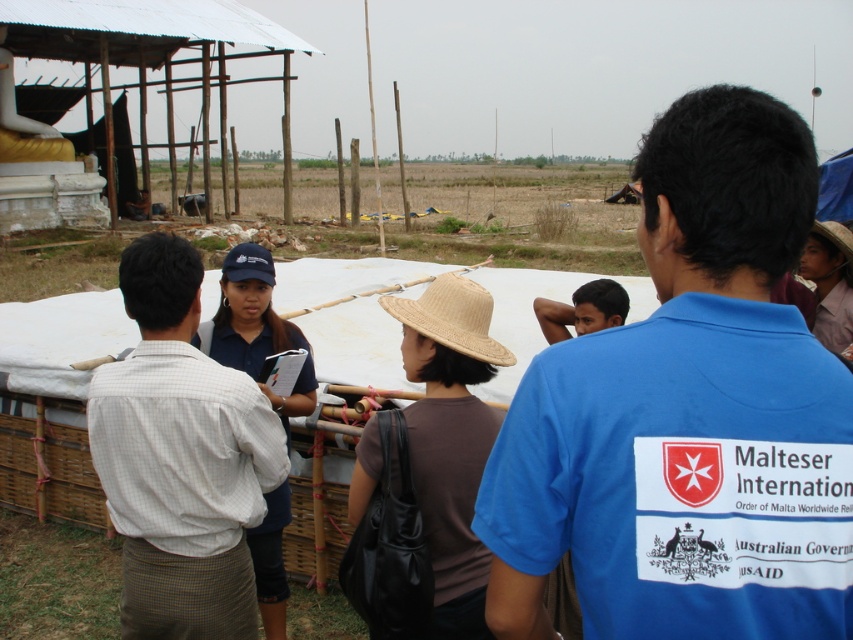
You are a photographer trying to capture a group photo of the individuals in the scene. You notice the blue cotton shirt at center and the tan straw hat at center. Which object should you focus on first if you want to ensure both are in focus, considering their height?

The blue cotton shirt at center is taller than the tan straw hat at center, so focusing on the blue cotton shirt at center first will ensure both are in focus since it is the taller object.

Based on the scene description, which object is larger in size between the light brown checkered shirt at center and the brown straw hat at center?

The light brown checkered shirt at center is bigger than the brown straw hat at center according to the description.